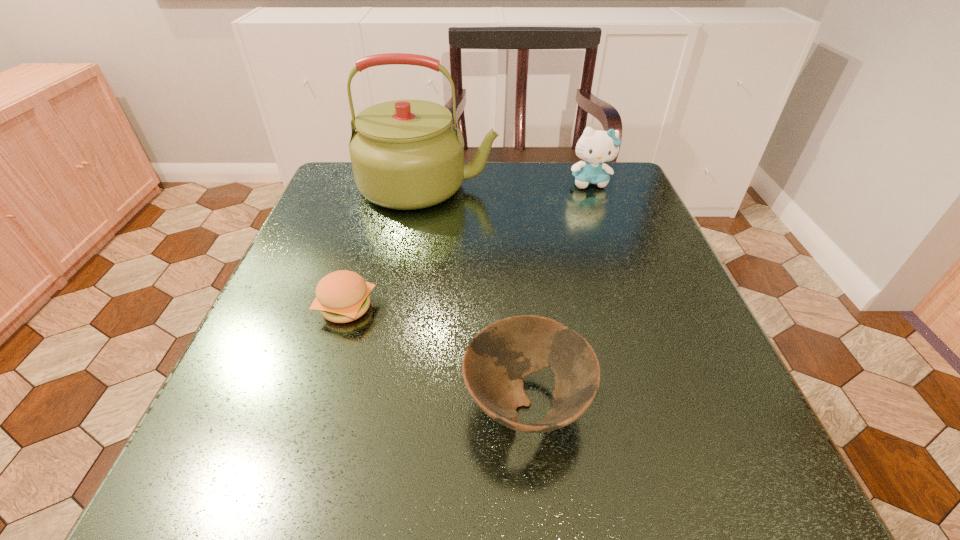
Find the location of a particular element. free spot located 0.350m on the back of the hamburger is located at coordinates (384, 189).

Locate an element on the screen. The width and height of the screenshot is (960, 540). kettle positioned at the far edge is located at coordinates (406, 154).

Identify the location of kitten located at the far edge. This screenshot has height=540, width=960. (595, 147).

Locate an element on the screen. This screenshot has height=540, width=960. object that is at the near edge is located at coordinates (496, 360).

Where is `kettle located in the left edge section of the desktop`? kettle located in the left edge section of the desktop is located at coordinates (406, 154).

I want to click on hamburger that is at the left edge, so coord(342,296).

Find the location of a particular element. This screenshot has width=960, height=540. object located at the right edge is located at coordinates (595, 147).

This screenshot has height=540, width=960. Identify the location of object positioned at the far left corner. (406, 154).

Where is `object positioned at the far right corner`? This screenshot has height=540, width=960. object positioned at the far right corner is located at coordinates (595, 147).

In the image, there is a desktop. In order to click on vacant space at the far edge in this screenshot , I will do `click(513, 182)`.